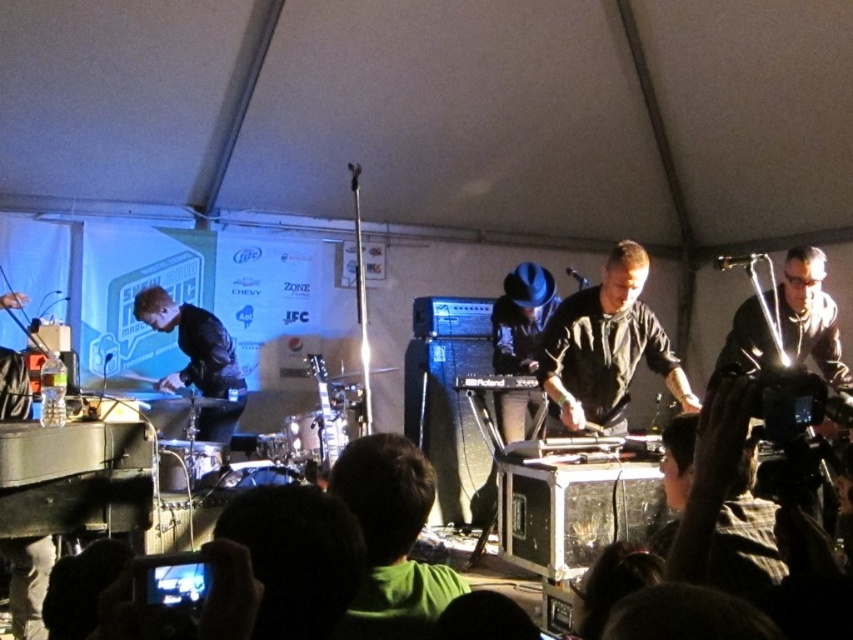
Looking at this image, you are a photographer positioned at point (326,416) in the image. You want to capture a closeup of the metallic guitar at center. Is the guitar at the exact center of the image?

The metallic guitar at center is located at point (326,416), so yes, the guitar is exactly at the center of the image.

You are a photographer at the music event. You need to capture a photo that includes both the black leather jacket at left and the metallic guitar at center. Based on their positions, which object should you focus on first to ensure both are in frame?

The black leather jacket at left is above the metallic guitar at center, so you should focus on the metallic guitar at center first to ensure both are in frame.